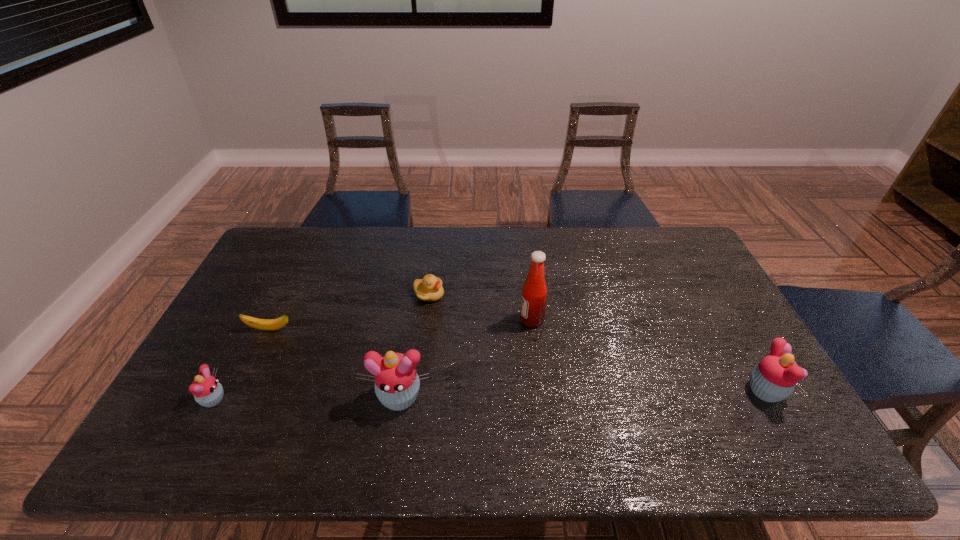
Find the location of `vacant space at the far edge of the desktop`. vacant space at the far edge of the desktop is located at coordinates (623, 242).

Locate an element on the screen. vacant space at the near edge is located at coordinates pyautogui.click(x=256, y=420).

Locate an element on the screen. The height and width of the screenshot is (540, 960). free region at the left edge is located at coordinates (229, 319).

The width and height of the screenshot is (960, 540). In the image, there is a desktop. What are the coordinates of `vacant space at the right edge` in the screenshot? It's located at (x=701, y=315).

Identify the location of free space at the near left corner of the desktop. The image size is (960, 540). (179, 404).

You are a GUI agent. You are given a task and a screenshot of the screen. Output one action in this format:
    pyautogui.click(x=<x>, y=<y>)
    Task: Click on the vacant area at the far right corner of the desktop
    This screenshot has width=960, height=540.
    Given the screenshot: What is the action you would take?
    pyautogui.click(x=681, y=266)

Identify the location of vacant space in between the second cupcake from left to right and the duckling. (414, 346).

Where is `vacant point located between the banana and the third tallest object`? The width and height of the screenshot is (960, 540). vacant point located between the banana and the third tallest object is located at coordinates (518, 360).

This screenshot has height=540, width=960. What are the coordinates of `free space between the farthest object and the second object from right to left` in the screenshot? It's located at (480, 307).

Where is `free spot between the fourth shortest object and the third shortest object`? The image size is (960, 540). free spot between the fourth shortest object and the third shortest object is located at coordinates (490, 396).